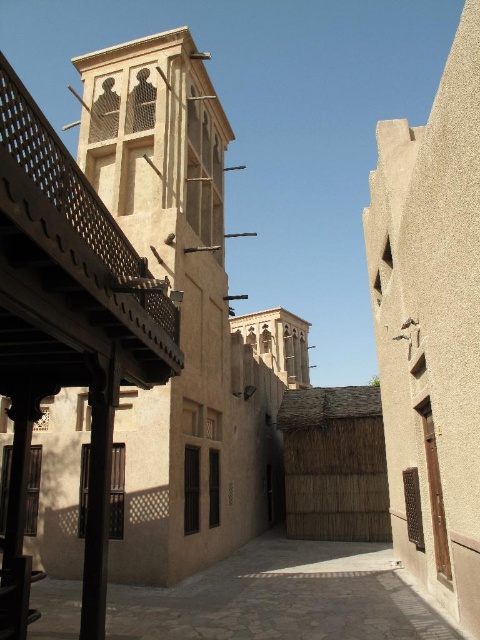
You are an architect visiting this historical site and want to install a new solar panel system. The beige textured tower at center and the brown textured courtyard at center are both potential locations. Based on their positions, which location would provide better sunlight exposure for the solar panels?

The beige textured tower at center is located above the brown textured courtyard at center, so it would receive more sunlight exposure as it is higher up and less likely to be shaded by surrounding structures. Installing the solar panels there would be more efficient.

You are standing at the base of the tower in the scene and want to walk to the point labeled point (x=398, y=570). There is an obstacle at point (x=164, y=188). Will you be able to see the obstacle from your starting position?

Point (x=164, y=188) is behind point (x=398, y=570), so you will not be able to see the obstacle at point (x=164, y=188) from your starting position because it is obscured by the point in front of it.

You are standing in the traditional Middle Eastern architectural scene. You need to locate the beige textured tower at center. Based on its coordinates, is it positioned closer to the left or right side of the image?

The beige textured tower at center is located at point 0.473 on the x and y axes, which places it near the center of the image, so it is neither closer to the left nor the right side.